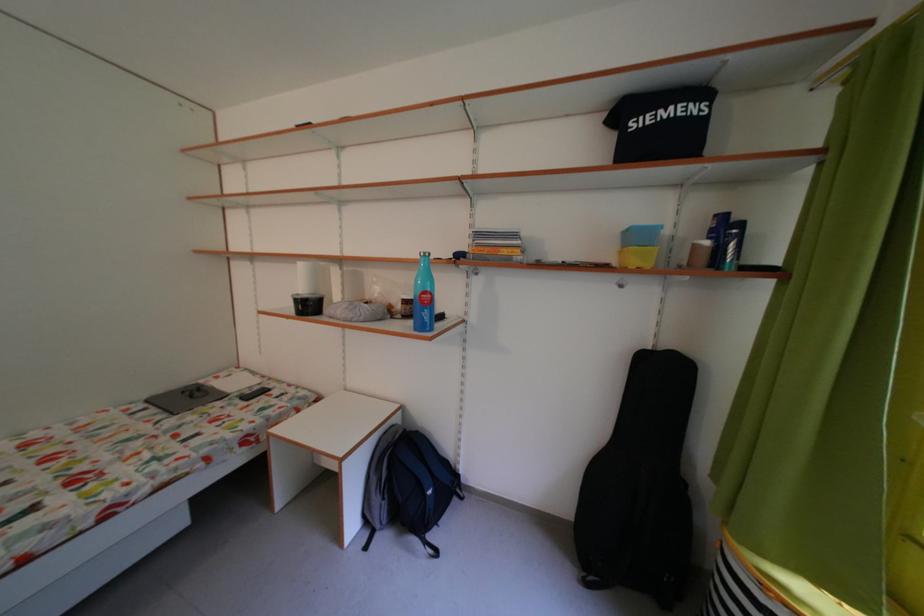
Find where to lift the small glass jar. Please return your answer as a coordinate pair (x, y).

(307, 304)